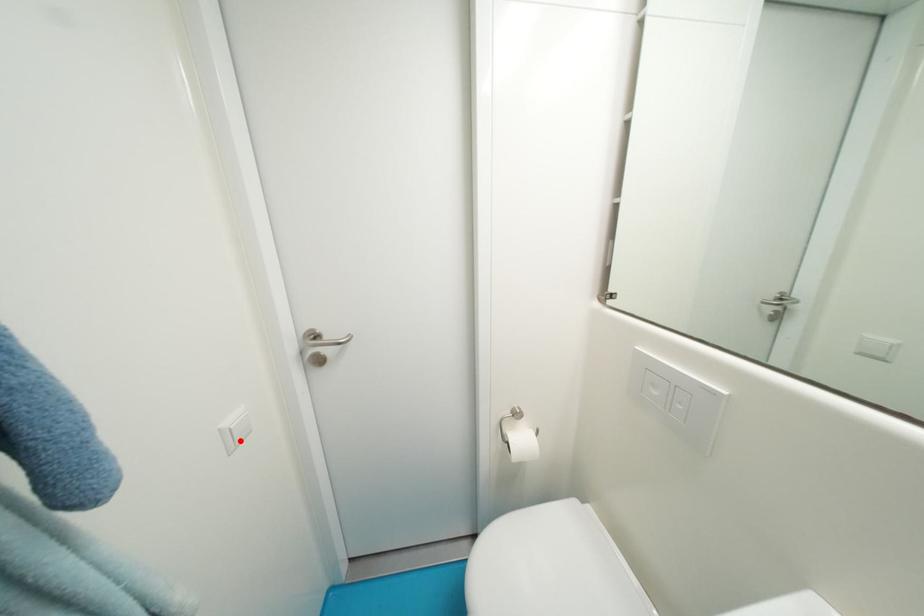
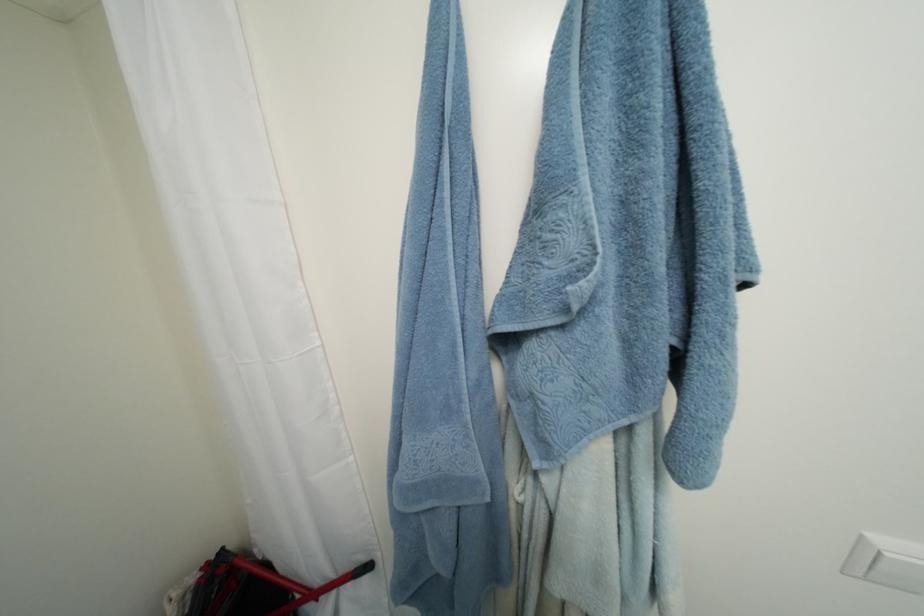
Find the pixel in the second image that matches the highlighted location in the first image.

(880, 570)